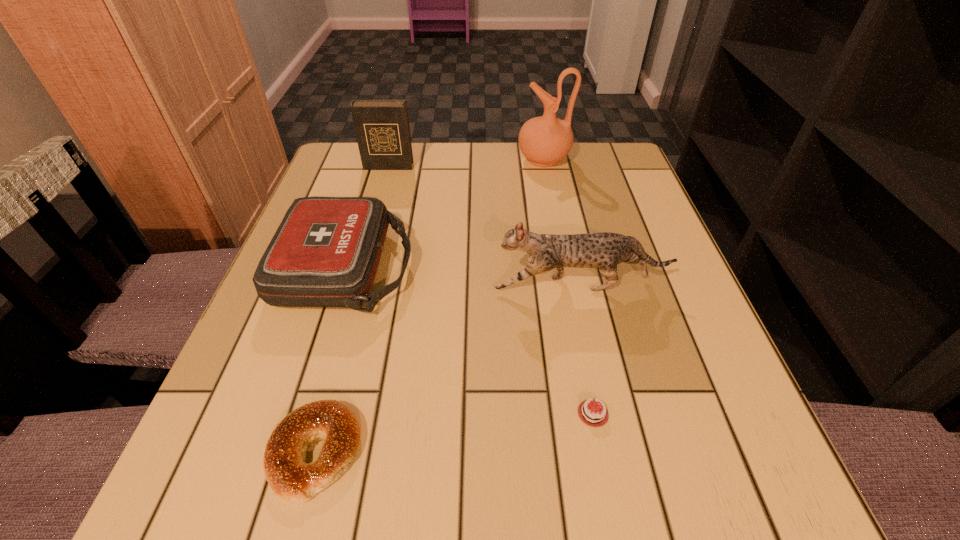
You are a GUI agent. You are given a task and a screenshot of the screen. Output one action in this format:
    pyautogui.click(x=<x>, y=<y>)
    Task: Click on the free space at the right edge of the desktop
    The width and height of the screenshot is (960, 540).
    Given the screenshot: What is the action you would take?
    pyautogui.click(x=635, y=194)

Find the location of a particular element. The width and height of the screenshot is (960, 540). vacant area at the far left corner is located at coordinates click(x=372, y=190).

The width and height of the screenshot is (960, 540). I want to click on free region at the far right corner of the desktop, so click(x=628, y=166).

Where is `empty location between the chocolate cake and the third tallest object`? The height and width of the screenshot is (540, 960). empty location between the chocolate cake and the third tallest object is located at coordinates (587, 349).

Find the location of a particular element. free point between the diary and the cat is located at coordinates (484, 226).

Image resolution: width=960 pixels, height=540 pixels. I want to click on free space between the diary and the tallest object, so click(x=466, y=163).

Locate an element on the screen. The height and width of the screenshot is (540, 960). vacant area between the cat and the shortest object is located at coordinates (587, 349).

This screenshot has height=540, width=960. I want to click on free space between the shortest object and the tallest object, so click(x=568, y=287).

What are the coordinates of `vacant area that lies between the pottery and the first-aid kit` in the screenshot? It's located at (445, 214).

Image resolution: width=960 pixels, height=540 pixels. I want to click on free point between the cat and the third shortest object, so click(x=464, y=276).